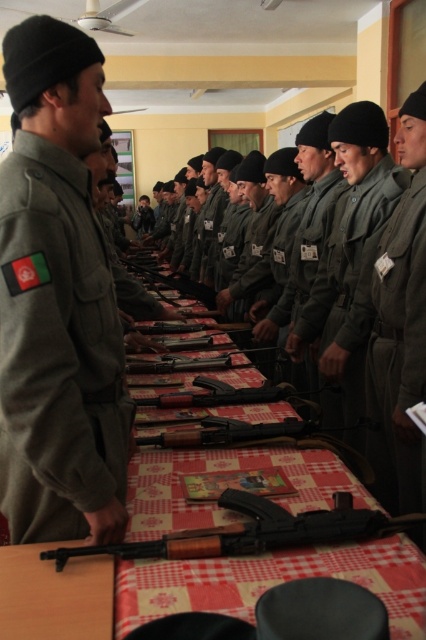
Where is the green matte uniform at left located in the image?

The green matte uniform at left is located at point [57,349] in the image.

You are a photographer positioned in front of the military formation. You want to take a photo that includes both the point at coordinate point (65, 177) and the point at coordinate point (157, 444). Which point will appear closer to the camera in the final photo?

Point (65, 177) is closer to the viewer than point (157, 444), so it will appear closer to the camera in the photo.